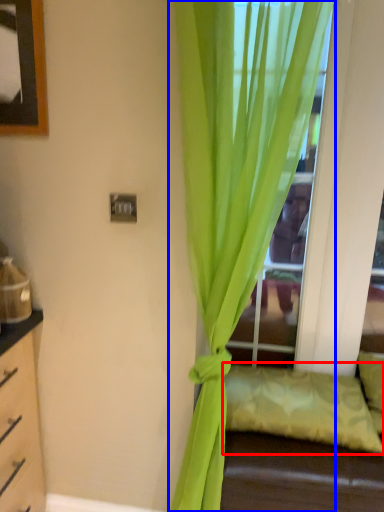
Question: Which of the following is the farthest to the observer, pillow (highlighted by a red box) or curtain (highlighted by a blue box)?

Choices:
 (A) pillow
 (B) curtain

Answer: (A)